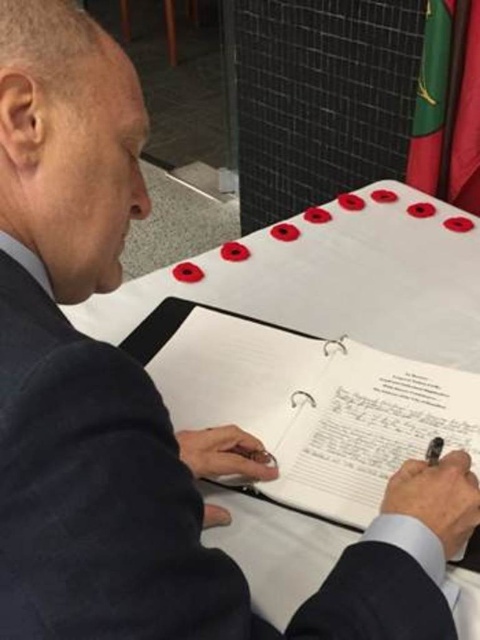
Question: Can you confirm if white paper at center is thinner than green fabric flag at upper right?

Choices:
 (A) no
 (B) yes

Answer: (A)

Question: Does white paper at center appear on the left side of green fabric flag at upper right?

Choices:
 (A) no
 (B) yes

Answer: (B)

Question: Can you confirm if white paper at center is positioned below green fabric flag at upper right?

Choices:
 (A) yes
 (B) no

Answer: (A)

Question: Which object is closer to the camera taking this photo?

Choices:
 (A) white paper at center
 (B) green fabric flag at upper right

Answer: (A)

Question: Among these objects, which one is farthest from the camera?

Choices:
 (A) green fabric flag at upper right
 (B) white paper at center

Answer: (A)